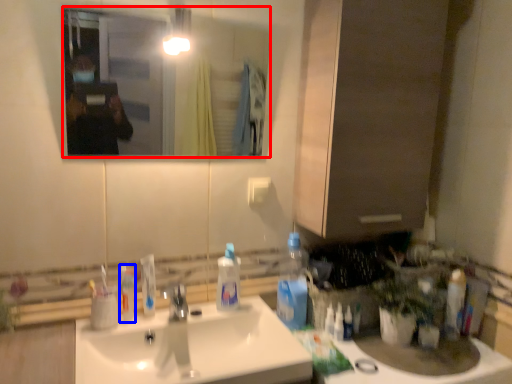
Question: Which point is further to the camera, mirror (highlighted by a red box) or mouthwash (highlighted by a blue box)?

Choices:
 (A) mirror
 (B) mouthwash

Answer: (B)